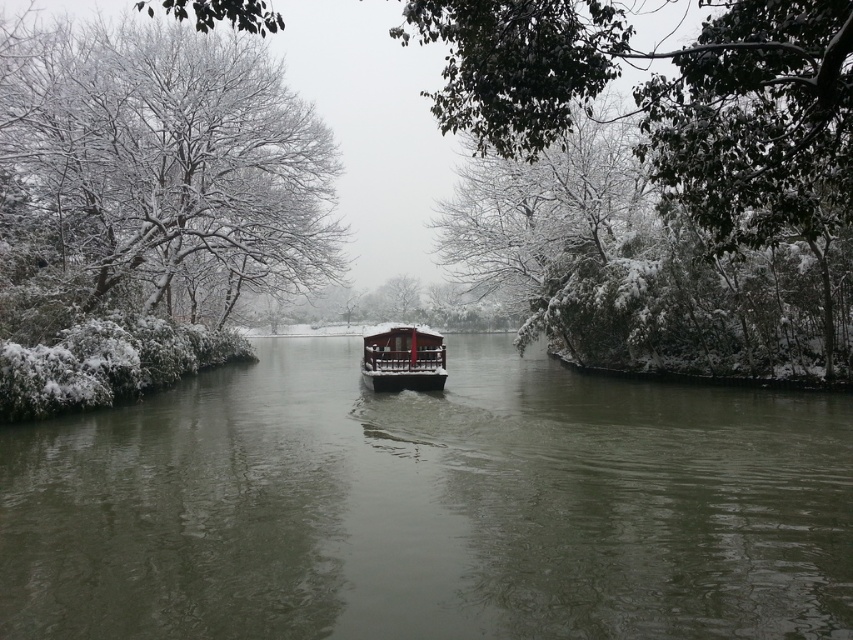
Which is behind, point (206, 243) or point (428, 385)?

Point (206, 243)

Is snow-covered branches at left closer to the viewer compared to shiny dark wood boat at center?

Yes, snow-covered branches at left is in front of shiny dark wood boat at center.

Is point (160, 40) farther from viewer compared to point (410, 326)?

Yes, it is behind point (410, 326).

Where is `snow-covered branches at left`? snow-covered branches at left is located at coordinates (155, 170).

Which is below, greenish-gray water at center or shiny dark wood boat at center?

greenish-gray water at center

Does point (709, 513) lie in front of point (439, 358)?

Yes, it is.

Locate an element on the screen. greenish-gray water at center is located at coordinates (430, 508).

Which is above, snow-covered tree at center or shiny dark wood boat at center?

Positioned higher is snow-covered tree at center.

Can you confirm if snow-covered tree at center is positioned to the left of shiny dark wood boat at center?

In fact, snow-covered tree at center is to the right of shiny dark wood boat at center.

At what (x,y) coordinates should I click in order to perform the action: click on snow-covered tree at center. Please return your answer as a coordinate pair (x, y). This screenshot has width=853, height=640. Looking at the image, I should click on (671, 102).